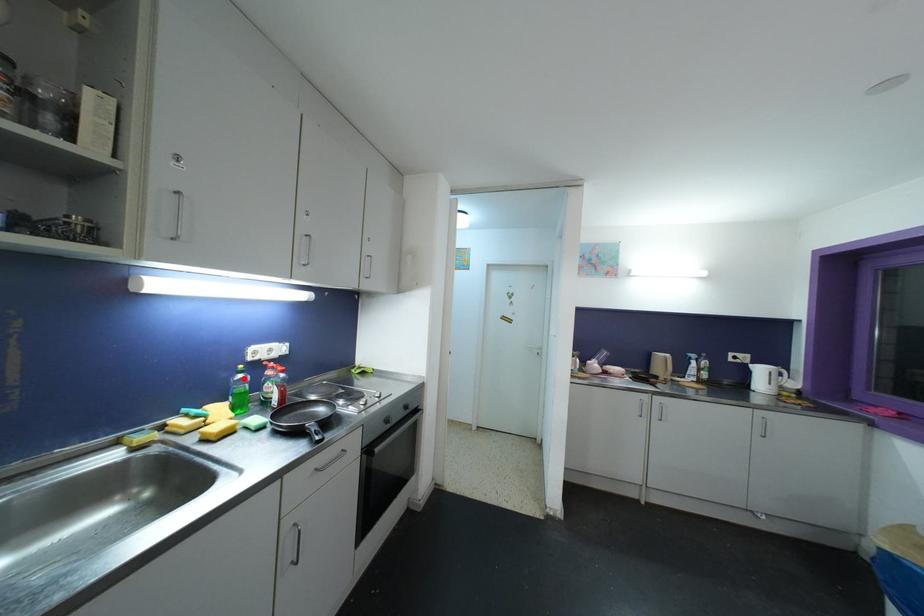
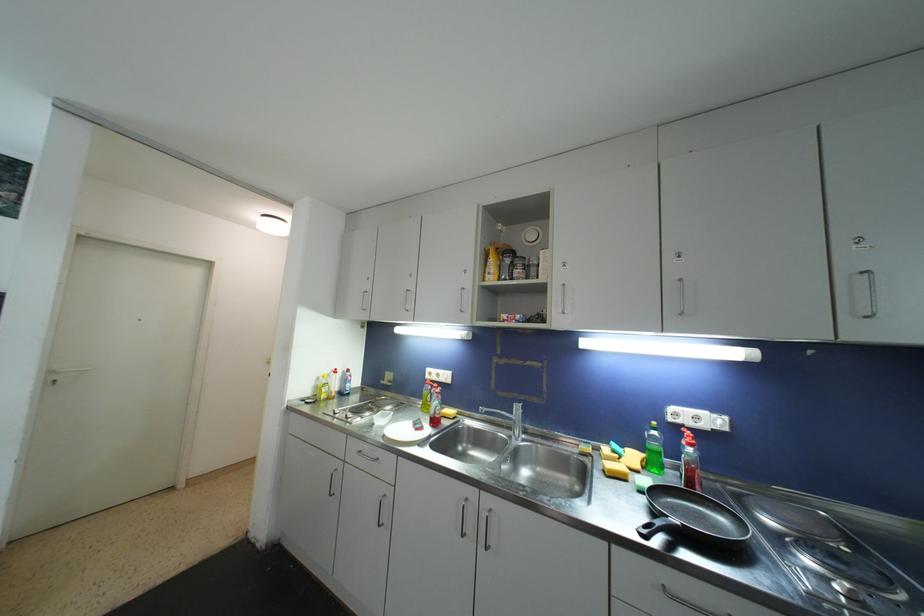
The point at the highlighted location is marked in the first image. Where is the corresponding point in the second image?

(658, 436)